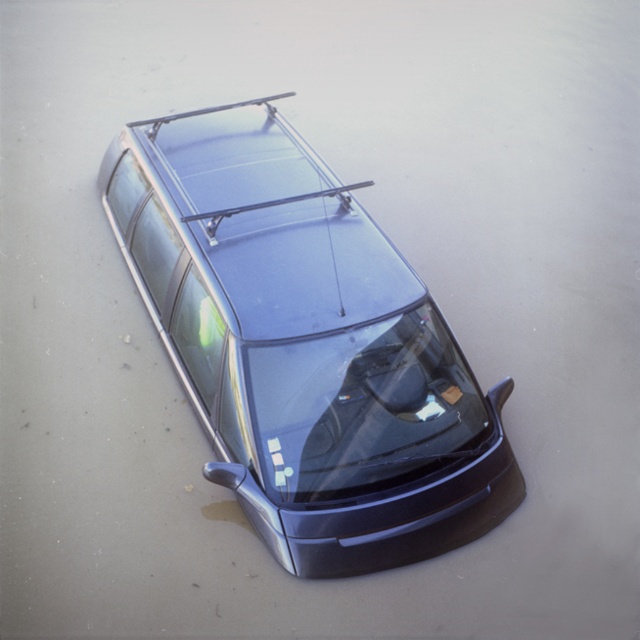
You are standing at the point marked as point (305,346). What object is located exactly at that point?

The point (305,346) is exactly where the satin black car at center is located.